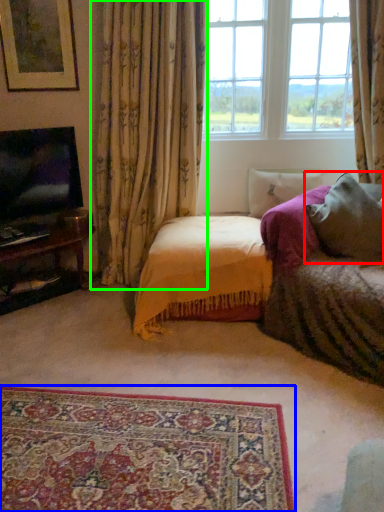
Question: Which object is positioned closest to pillow (highlighted by a red box)? Select from plain (highlighted by a blue box) and curtain (highlighted by a green box).

Choices:
 (A) plain
 (B) curtain

Answer: (B)